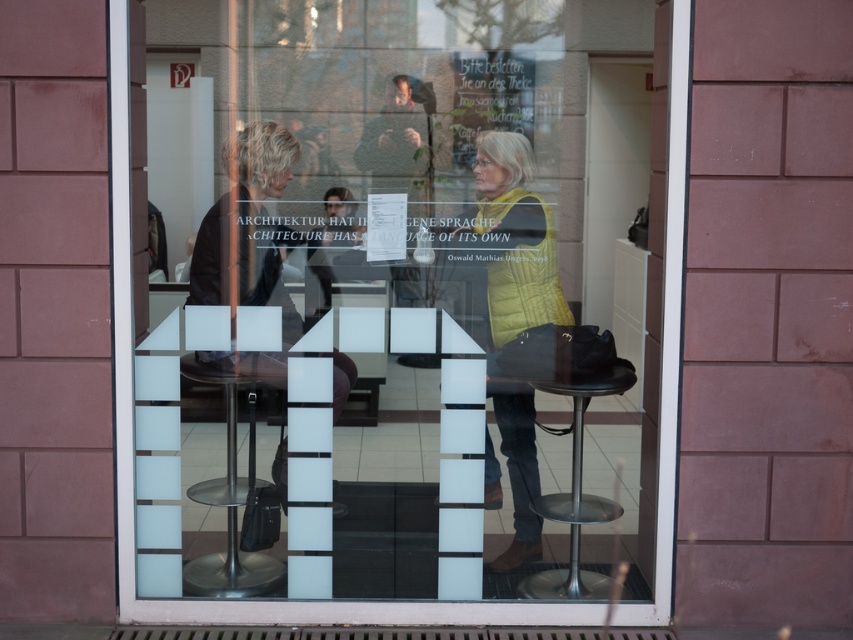
Question: Considering the real-world distances, which object is farthest from the metallic black stool at lower right?

Choices:
 (A) matte black jacket at center
 (B) yellow knitted sweater at center
 (C) metallic silver stool at center
 (D) transparent glass window at center

Answer: (C)

Question: Is transparent glass window at center further to camera compared to yellow knitted sweater at center?

Choices:
 (A) no
 (B) yes

Answer: (A)

Question: Is yellow knitted sweater at center positioned behind matte black jacket at center?

Choices:
 (A) yes
 (B) no

Answer: (A)

Question: Which of the following is the farthest from the observer?

Choices:
 (A) transparent glass window at center
 (B) matte black jacket at center

Answer: (B)

Question: Which object is the farthest from the yellow knitted sweater at center?

Choices:
 (A) transparent glass window at center
 (B) metallic silver stool at center

Answer: (B)

Question: Does transparent glass window at center have a lesser width compared to metallic silver stool at center?

Choices:
 (A) yes
 (B) no

Answer: (B)